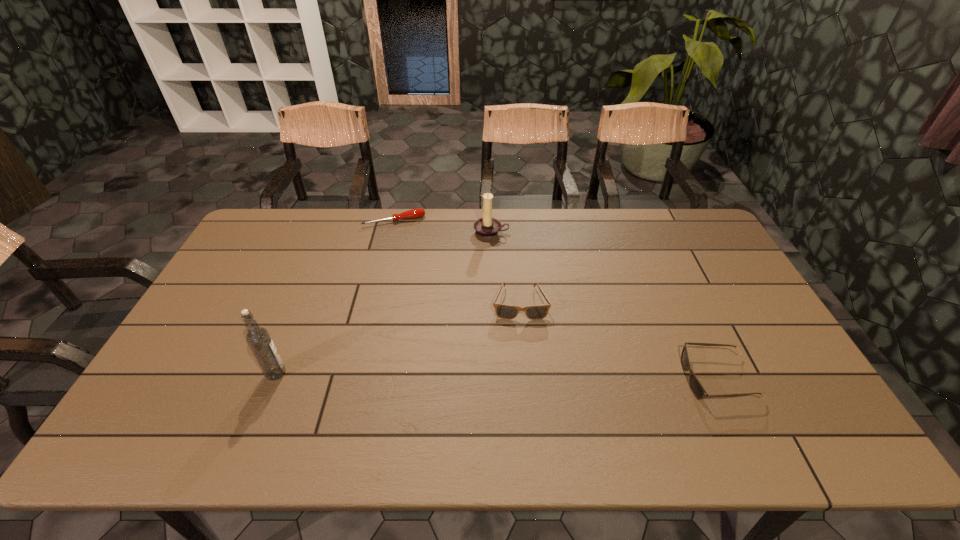
Locate an element on the screen. The image size is (960, 540). vacant space located 0.080m on the frames of the farther sunglasses is located at coordinates point(522,342).

Locate an element on the screen. This screenshot has height=540, width=960. blank area located on the frames of the farther sunglasses is located at coordinates (524, 379).

I want to click on screwdriver that is at the far edge, so click(x=414, y=213).

Locate an element on the screen. candle holder positioned at the far edge is located at coordinates (487, 227).

The width and height of the screenshot is (960, 540). What are the coordinates of `vodka that is positioned at the near edge` in the screenshot? It's located at (258, 339).

The image size is (960, 540). I want to click on sunglasses situated at the near edge, so click(699, 392).

The image size is (960, 540). In order to click on object that is at the right edge in this screenshot , I will do `click(699, 392)`.

I want to click on object that is at the near right corner, so click(x=699, y=392).

The width and height of the screenshot is (960, 540). In order to click on free region at the far edge of the desktop in this screenshot , I will do pyautogui.click(x=372, y=227).

This screenshot has width=960, height=540. Find the location of `vacant space at the near edge of the desktop`. vacant space at the near edge of the desktop is located at coordinates (587, 395).